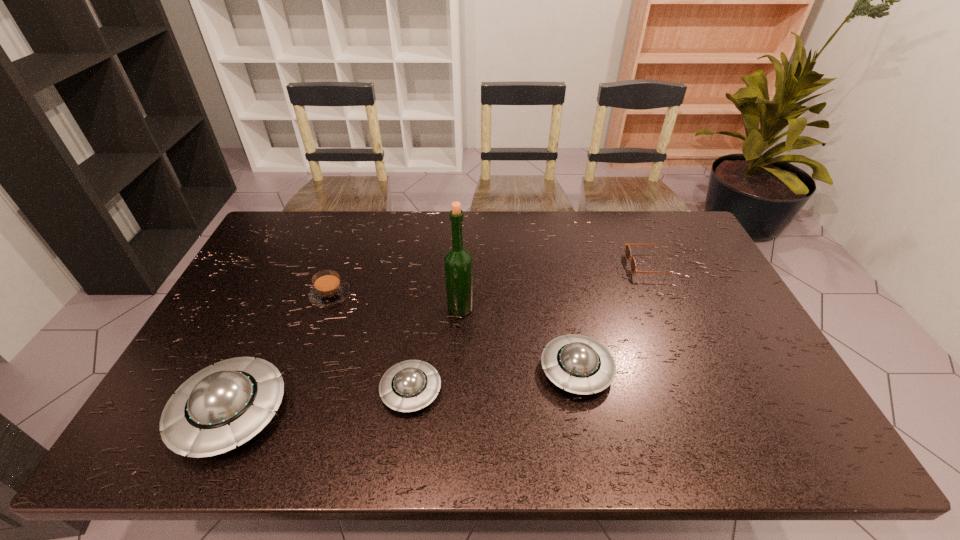
This screenshot has width=960, height=540. What are the coordinates of `unoccupied area between the liquor and the cappuccino` in the screenshot? It's located at (396, 301).

In order to click on vacant area that lies between the farthest object and the shortest saucer in this screenshot , I will do `click(531, 328)`.

You are a GUI agent. You are given a task and a screenshot of the screen. Output one action in this format:
    pyautogui.click(x=<x>, y=<y>)
    Task: Click on the vacant area that lies between the cappuccino and the second shortest saucer
    
    Given the screenshot: What is the action you would take?
    pyautogui.click(x=453, y=333)

Locate an element on the screen. free area in between the second saucer from right to left and the fifth shortest object is located at coordinates (321, 402).

Locate an element on the screen. This screenshot has width=960, height=540. empty space between the second saucer from left to right and the leftmost saucer is located at coordinates (321, 402).

Identify the location of object that can be found as the second closest to the second tallest saucer. (410, 385).

Locate an element on the screen. the fifth closest object to the second saucer from right to left is located at coordinates (633, 266).

Select which saucer is the third closest to the cappuccino. Please provide its 2D coordinates. Your answer should be formatted as a tuple, i.e. [(x, y)], where the tuple contains the x and y coordinates of a point satisfying the conditions above.

[(576, 363)]

Image resolution: width=960 pixels, height=540 pixels. In order to click on saucer that is the closest to the shortest saucer in this screenshot , I will do `click(226, 404)`.

Where is `free space that satisfies the following two spatial constraints: 1. on the back side of the tallest object; 2. on the left side of the tallest saucer`? free space that satisfies the following two spatial constraints: 1. on the back side of the tallest object; 2. on the left side of the tallest saucer is located at coordinates (280, 308).